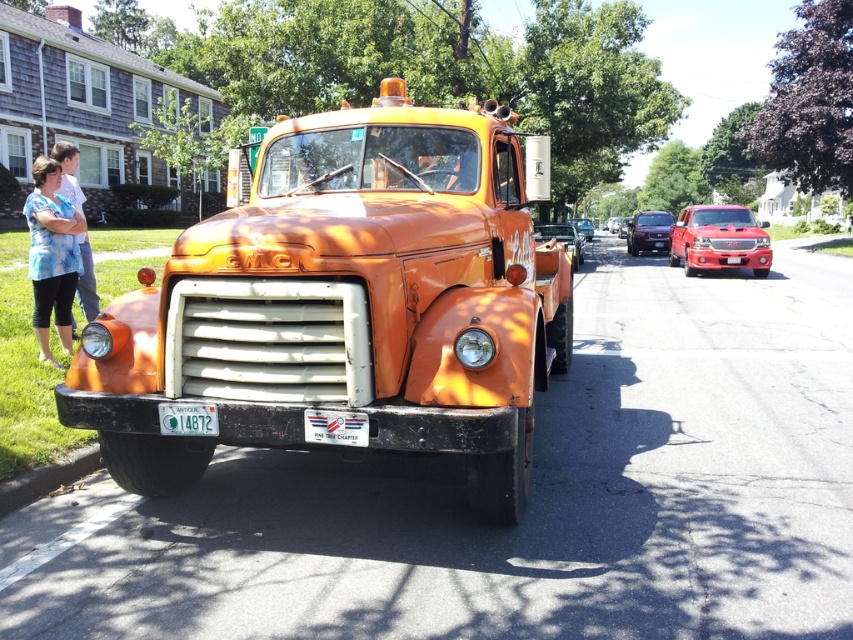
Does orange matte tow truck at center have a lesser width compared to green plastic license plate at center?

Incorrect, orange matte tow truck at center's width is not less than green plastic license plate at center's.

What are the coordinates of `orange matte tow truck at center` in the screenshot? It's located at (347, 307).

Does point (292, 326) come behind point (68, 189)?

No, (292, 326) is in front of (68, 189).

Locate an element on the screen. The image size is (853, 640). orange matte tow truck at center is located at coordinates (347, 307).

Where is `orange matte tow truck at center`? orange matte tow truck at center is located at coordinates (347, 307).

Which is below, glossy red truck at center or glossy maroon sedan at center?

glossy red truck at center is lower down.

Who is more distant from viewer, (695, 262) or (640, 220)?

The point (640, 220) is behind.

Find the location of a particular element. The height and width of the screenshot is (640, 853). glossy red truck at center is located at coordinates (718, 240).